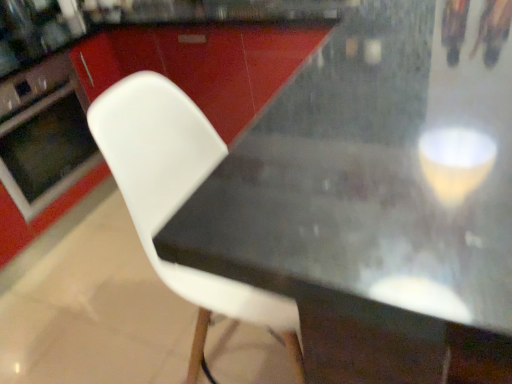
Question: Is white plastic chair at center at the right side of matte black oven at left?

Choices:
 (A) yes
 (B) no

Answer: (A)

Question: Would you say matte black oven at left is part of white plastic chair at center's contents?

Choices:
 (A) no
 (B) yes

Answer: (A)

Question: Would you say white plastic chair at center is a long distance from matte black oven at left?

Choices:
 (A) yes
 (B) no

Answer: (A)

Question: Can you confirm if white plastic chair at center is bigger than matte black oven at left?

Choices:
 (A) no
 (B) yes

Answer: (B)

Question: Is white plastic chair at center taller than matte black oven at left?

Choices:
 (A) no
 (B) yes

Answer: (B)

Question: Looking at their shapes, would you say matte black oven at left is wider or thinner than white plastic chair at center?

Choices:
 (A) thin
 (B) wide

Answer: (B)

Question: Is point (1, 155) closer or farther from the camera than point (215, 286)?

Choices:
 (A) farther
 (B) closer

Answer: (A)

Question: Based on their sizes in the image, would you say matte black oven at left is bigger or smaller than white plastic chair at center?

Choices:
 (A) big
 (B) small

Answer: (B)

Question: From the image's perspective, is matte black oven at left above or below white plastic chair at center?

Choices:
 (A) below
 (B) above

Answer: (B)

Question: In the image, is black matte table at center positioned in front of or behind white plastic chair at center?

Choices:
 (A) front
 (B) behind

Answer: (A)

Question: Is point (396, 89) closer or farther from the camera than point (206, 289)?

Choices:
 (A) closer
 (B) farther

Answer: (A)

Question: From the image's perspective, is black matte table at center located above or below white plastic chair at center?

Choices:
 (A) below
 (B) above

Answer: (B)

Question: Is black matte table at center taller or shorter than white plastic chair at center?

Choices:
 (A) tall
 (B) short

Answer: (B)

Question: Do you think white plastic chair at center is within matte black oven at left, or outside of it?

Choices:
 (A) outside
 (B) inside

Answer: (A)

Question: Considering the positions of white plastic chair at center and matte black oven at left in the image, is white plastic chair at center taller or shorter than matte black oven at left?

Choices:
 (A) short
 (B) tall

Answer: (B)